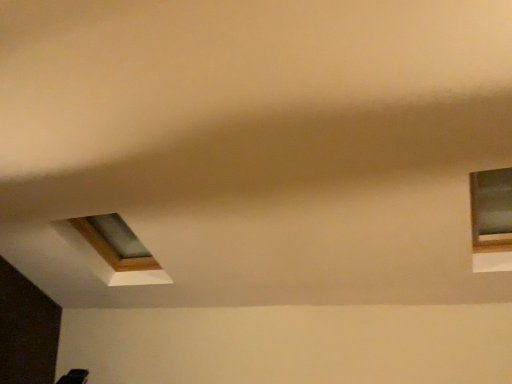
Question: Should I look upward or downward to see transparent glass window at upper left, which is counted as the 1th window, starting from the back?

Choices:
 (A) up
 (B) down

Answer: (B)

Question: Is transparent glass window at upper left, which is counted as the 1th window, starting from the back, taller than matte glass window at upper right, the 1th window from the front?

Choices:
 (A) no
 (B) yes

Answer: (A)

Question: Considering the relative positions of transparent glass window at upper left, which is counted as the 1th window, starting from the back, and matte glass window at upper right, the 1th window from the front, in the image provided, is transparent glass window at upper left, which is counted as the 1th window, starting from the back, in front of matte glass window at upper right, the 1th window from the front,?

Choices:
 (A) yes
 (B) no

Answer: (B)

Question: Is transparent glass window at upper left, the 1th window positioned from the left, not near matte glass window at upper right, the second window in the left-to-right sequence?

Choices:
 (A) yes
 (B) no

Answer: (A)

Question: From the image's perspective, is transparent glass window at upper left, which is counted as the 1th window, starting from the back, located beneath matte glass window at upper right, the second window in the left-to-right sequence?

Choices:
 (A) no
 (B) yes

Answer: (B)

Question: From a real-world perspective, is transparent glass window at upper left, which is counted as the 1th window, starting from the back, located higher than matte glass window at upper right, the second window in the left-to-right sequence?

Choices:
 (A) yes
 (B) no

Answer: (B)

Question: Does transparent glass window at upper left, which appears as the 2th window when viewed from the right, appear on the left side of matte glass window at upper right, the second window in the left-to-right sequence?

Choices:
 (A) no
 (B) yes

Answer: (B)

Question: Would you say matte glass window at upper right, the second window in the left-to-right sequence, contains transparent glass window at upper left, which appears as the 2th window when viewed from the right?

Choices:
 (A) no
 (B) yes

Answer: (A)

Question: From the image's perspective, is matte glass window at upper right, the 1th window when ordered from right to left, on top of transparent glass window at upper left, which is counted as the 1th window, starting from the back?

Choices:
 (A) yes
 (B) no

Answer: (A)

Question: Considering the relative positions of matte glass window at upper right, the 1th window from the front, and transparent glass window at upper left, which is counted as the 1th window, starting from the back, in the image provided, is matte glass window at upper right, the 1th window from the front, to the left of transparent glass window at upper left, which is counted as the 1th window, starting from the back, from the viewer's perspective?

Choices:
 (A) yes
 (B) no

Answer: (B)

Question: Does matte glass window at upper right, the second window in the left-to-right sequence, have a greater height compared to transparent glass window at upper left, which appears as the 2th window when viewed from the right?

Choices:
 (A) yes
 (B) no

Answer: (A)

Question: Considering the relative sizes of matte glass window at upper right, the second window in the left-to-right sequence, and transparent glass window at upper left, placed as the 2th window when sorted from front to back, in the image provided, is matte glass window at upper right, the second window in the left-to-right sequence, thinner than transparent glass window at upper left, placed as the 2th window when sorted from front to back,?

Choices:
 (A) yes
 (B) no

Answer: (B)

Question: Could you tell me if matte glass window at upper right, the 1th window when ordered from right to left, is facing transparent glass window at upper left, the 1th window positioned from the left?

Choices:
 (A) no
 (B) yes

Answer: (A)

Question: From the image's perspective, is transparent glass window at upper left, which appears as the 2th window when viewed from the right, positioned above or below matte glass window at upper right, the second window in the left-to-right sequence?

Choices:
 (A) below
 (B) above

Answer: (A)